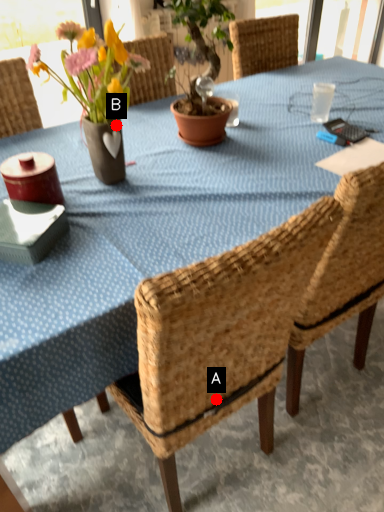
Question: Two points are circled on the image, labeled by A and B beside each circle. Among these points, which one is farthest from the camera?

Choices:
 (A) A is further
 (B) B is further

Answer: (B)